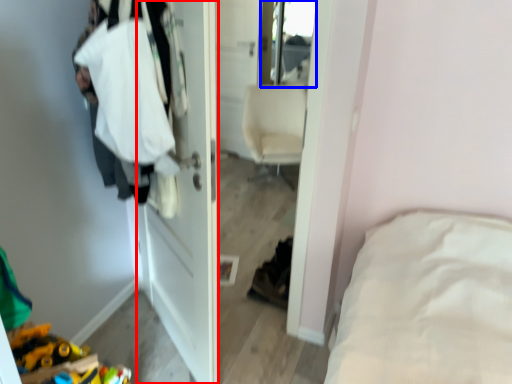
Question: Among these objects, which one is nearest to the camera, door (highlighted by a red box) or mirror (highlighted by a blue box)?

Choices:
 (A) door
 (B) mirror

Answer: (A)